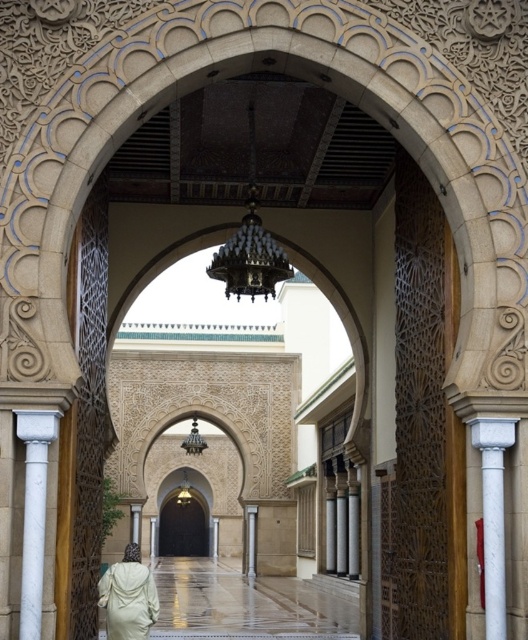
Is white marble column at left positioned in front of white marble column at right?

Yes, white marble column at left is closer to the viewer.

Is white marble column at left bigger than white marble column at right?

No.

Describe the element at coordinates (33, 513) in the screenshot. I see `white marble column at left` at that location.

This screenshot has width=528, height=640. Find the location of `white marble column at left`. white marble column at left is located at coordinates (33, 513).

You are a GUI agent. You are given a task and a screenshot of the screen. Output one action in this format:
    pyautogui.click(x=<x>, y=<y>)
    Task: Click on the white marble column at right
    
    Given the screenshot: What is the action you would take?
    pyautogui.click(x=494, y=515)

Does white marble column at right come behind white marble column at center?

No, it is not.

Does point (499, 570) come in front of point (253, 506)?

Yes, it is.

I want to click on white marble column at right, so click(x=494, y=515).

Does white marble column at right lie behind light beige fabric dress at lower left?

No, it is not.

Is point (483, 454) farther from viewer compared to point (117, 628)?

No, it is in front of (117, 628).

Which is in front, point (476, 429) or point (107, 605)?

Point (476, 429)

Image resolution: width=528 pixels, height=640 pixels. What are the coordinates of `white marble column at right` in the screenshot? It's located at (494, 515).